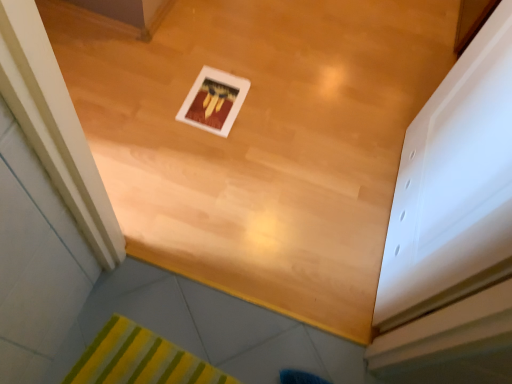
Describe the element at coordinates (214, 101) in the screenshot. I see `white glossy picture frame at center` at that location.

Find the location of a particular element. white glossy picture frame at center is located at coordinates (214, 101).

This screenshot has height=384, width=512. What are the coordinates of `white glossy picture frame at center` in the screenshot? It's located at (214, 101).